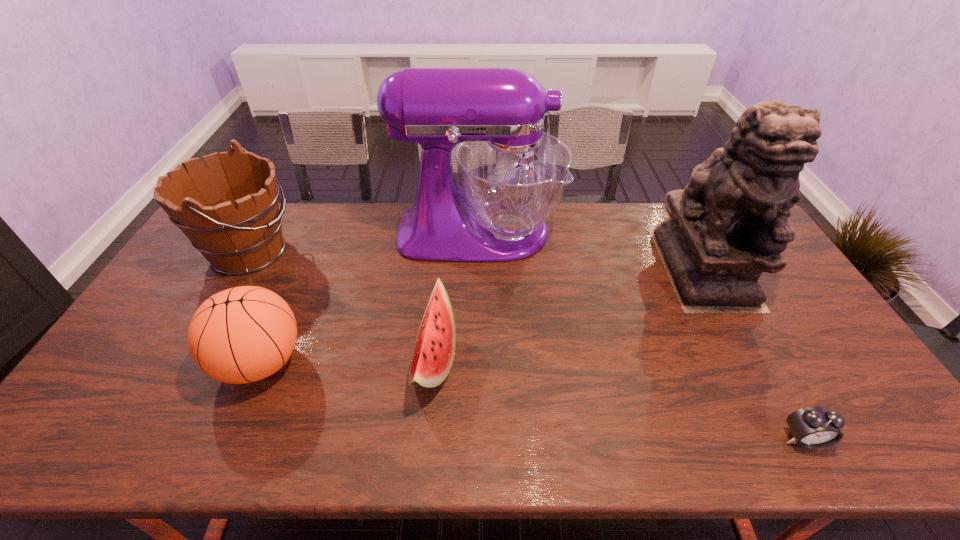
The height and width of the screenshot is (540, 960). In order to click on vacant space that is in between the fourth tallest object and the shortest object in this screenshot , I will do `click(532, 400)`.

Identify the location of object that is the fifth closest to the watermelon. (815, 427).

Find the location of a particular element. This screenshot has height=540, width=960. the fourth closest object to the fourth tallest object is located at coordinates (730, 223).

Locate an element on the screen. This screenshot has width=960, height=540. vacant region that satisfies the following two spatial constraints: 1. with the handle on the wine bucket; 2. on the left side of the basketball is located at coordinates (187, 362).

At what (x,y) coordinates should I click in order to perform the action: click on vacant area that satisfies the following two spatial constraints: 1. with the handle on the wine bucket; 2. on the right side of the basketball. Please return your answer as a coordinate pair (x, y). This screenshot has height=540, width=960. Looking at the image, I should click on (187, 362).

Where is `vacant region that satisfies the following two spatial constraints: 1. with the handle on the third tallest object; 2. on the left side of the third shortest object`? This screenshot has width=960, height=540. vacant region that satisfies the following two spatial constraints: 1. with the handle on the third tallest object; 2. on the left side of the third shortest object is located at coordinates (187, 362).